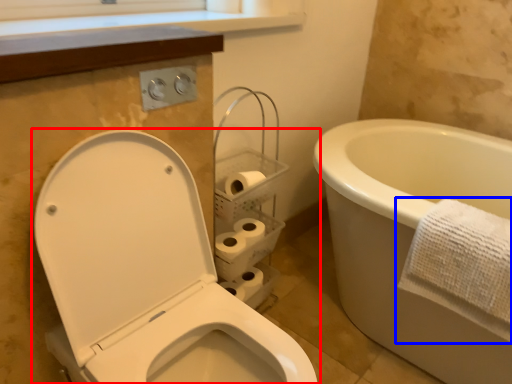
Question: Which point is further to the camera, toilet (highlighted by a red box) or towel (highlighted by a blue box)?

Choices:
 (A) toilet
 (B) towel

Answer: (B)